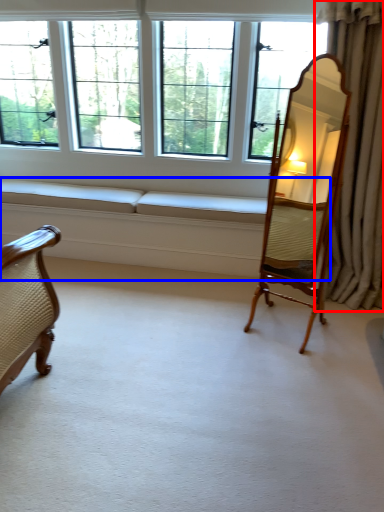
Question: Which of the following is the farthest to the observer, curtain (highlighted by a red box) or couch (highlighted by a blue box)?

Choices:
 (A) curtain
 (B) couch

Answer: (B)